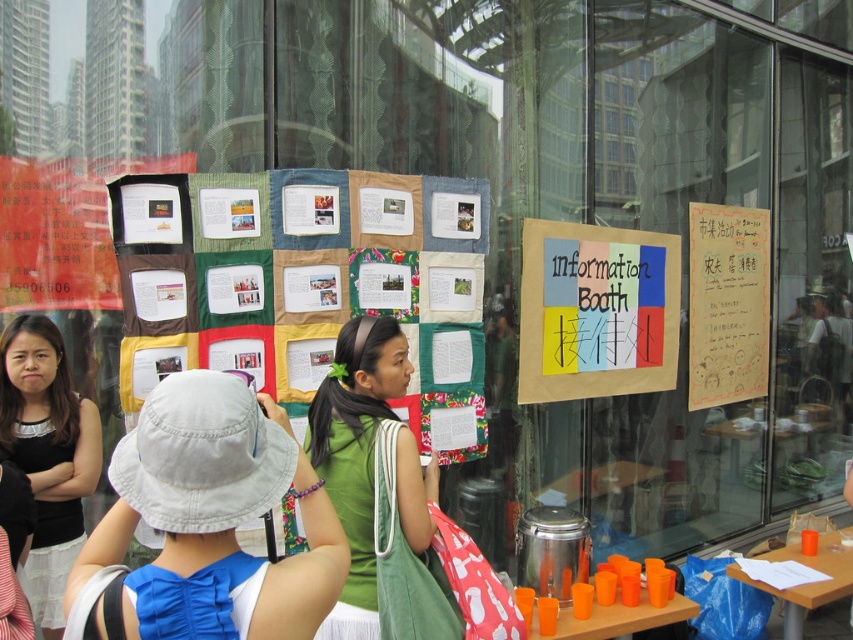
Question: Which of the following is the closest to the observer?

Choices:
 (A) (210, 464)
 (B) (3, 390)
 (C) (677, 328)

Answer: (A)

Question: Is light gray fabric bucket hat at center closer to the viewer compared to handwritten paper poster at right?

Choices:
 (A) no
 (B) yes

Answer: (B)

Question: Among these objects, which one is nearest to the camera?

Choices:
 (A) light gray fabric bucket hat at center
 (B) multicolored paper sign at center

Answer: (A)

Question: Among these objects, which one is nearest to the camera?

Choices:
 (A) black fabric dress at left
 (B) light gray fabric bucket hat at center
 (C) handwritten paper poster at right
 (D) matte paper poster at center

Answer: (B)

Question: Is textured fabric bulletin board at center above multicolored paper sign at center?

Choices:
 (A) yes
 (B) no

Answer: (A)

Question: Is textured fabric bulletin board at center to the left of handwritten paper poster at right from the viewer's perspective?

Choices:
 (A) no
 (B) yes

Answer: (B)